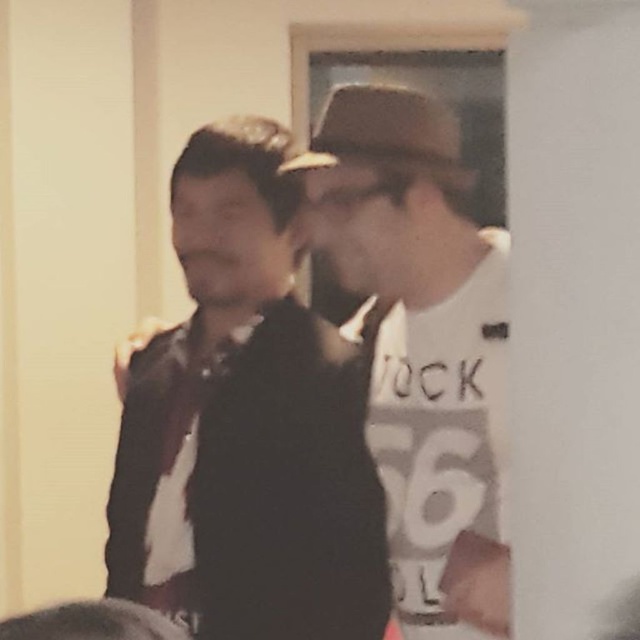
In the scene shown: Does white matte t-shirt at center have a lesser width compared to brown felt fedora at upper center?

Incorrect, white matte t-shirt at center's width is not less than brown felt fedora at upper center's.

From the picture: Between white matte t-shirt at center and brown felt fedora at upper center, which one appears on the right side from the viewer's perspective?

white matte t-shirt at center is more to the right.

Image resolution: width=640 pixels, height=640 pixels. Describe the element at coordinates (412, 243) in the screenshot. I see `white matte t-shirt at center` at that location.

Locate an element on the screen. The width and height of the screenshot is (640, 640). white matte t-shirt at center is located at coordinates (412, 243).

Between point (118, 513) and point (426, 228), which one is positioned behind?

The point (118, 513) is more distant.

Which is behind, point (364, 388) or point (461, 561)?

The point (364, 388) is more distant.

Locate an element on the screen. black velvet dress at center is located at coordinates (289, 492).

Does point (371, 625) come closer to viewer compared to point (332, 131)?

No.

Between point (234, 384) and point (392, 124), which one is positioned behind?

Positioned behind is point (234, 384).

Is point (305, 465) positioned behind point (397, 170)?

Yes.

Where is `black velvet dress at center`? black velvet dress at center is located at coordinates (289, 492).